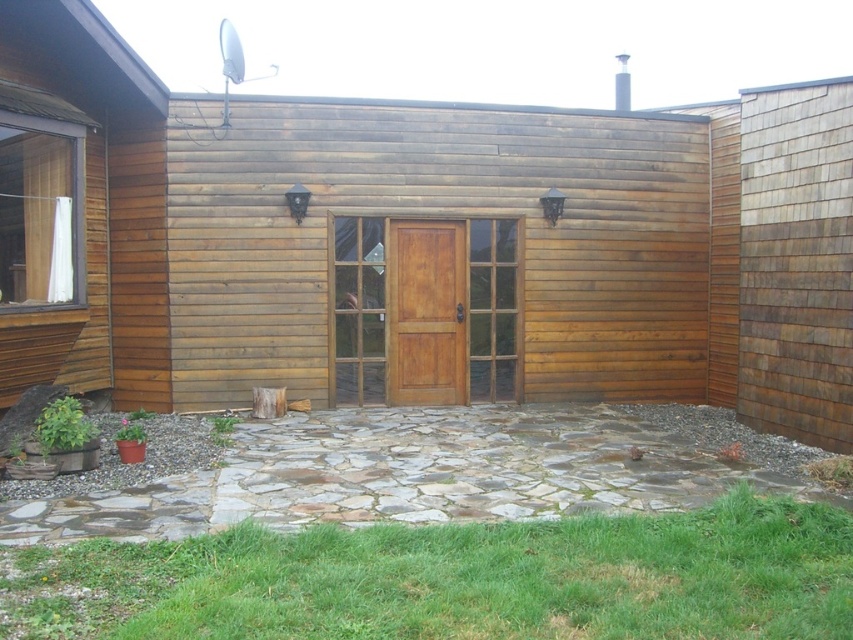
You are standing at the entrance of the wooden building and want to walk towards the green grass at lower center. Which direction should you move relative to the brown wooden screen door at center?

The green grass at lower center is to the left of the brown wooden screen door at center, so you should move to the left side of the brown wooden screen door at center to reach the green grass at lower center.

You are standing on the stone pathway leading to the entrance. You want to step onto the green grass at lower center. Is the grass lower than the brown wooden screen door at center?

Yes, the green grass at lower center is shorter than the brown wooden screen door at center, so it is lower.